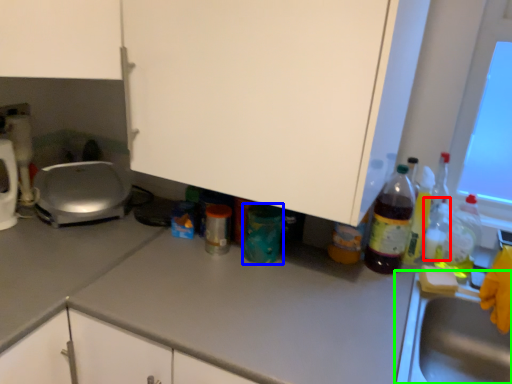
Question: Which object is positioned farthest from bottle (highlighted by a red box)? Select from bottle (highlighted by a blue box) and sink (highlighted by a green box).

Choices:
 (A) bottle
 (B) sink

Answer: (A)